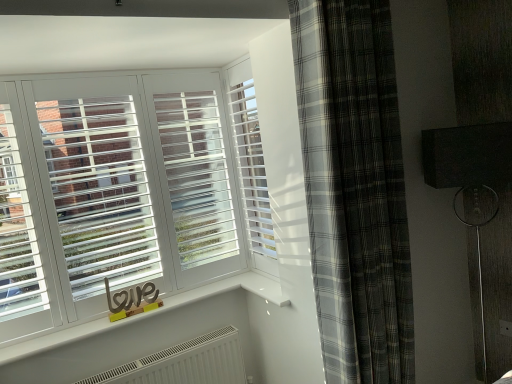
Question: Should I look upward or downward to see gray plaid curtain at right?

Choices:
 (A) up
 (B) down

Answer: (B)

Question: Should I look upward or downward to see white plastic blinds at center?

Choices:
 (A) up
 (B) down

Answer: (A)

Question: Are gray plaid curtain at right and white plastic blinds at center far apart?

Choices:
 (A) yes
 (B) no

Answer: (B)

Question: Is white plastic blinds at center inside gray plaid curtain at right?

Choices:
 (A) yes
 (B) no

Answer: (B)

Question: Considering the relative sizes of gray plaid curtain at right and white plastic blinds at center in the image provided, is gray plaid curtain at right taller than white plastic blinds at center?

Choices:
 (A) no
 (B) yes

Answer: (B)

Question: Can you confirm if gray plaid curtain at right is bigger than white plastic blinds at center?

Choices:
 (A) yes
 (B) no

Answer: (A)

Question: Considering the relative sizes of gray plaid curtain at right and white plastic blinds at center in the image provided, is gray plaid curtain at right shorter than white plastic blinds at center?

Choices:
 (A) yes
 (B) no

Answer: (B)

Question: Considering the relative sizes of gray plaid curtain at right and white plastic blinds at center in the image provided, is gray plaid curtain at right wider than white plastic blinds at center?

Choices:
 (A) no
 (B) yes

Answer: (B)

Question: Considering the relative sizes of white plastic blinds at center and gray plaid curtain at right in the image provided, is white plastic blinds at center wider than gray plaid curtain at right?

Choices:
 (A) no
 (B) yes

Answer: (A)

Question: Considering the relative sizes of white plastic blinds at center and gray plaid curtain at right in the image provided, is white plastic blinds at center taller than gray plaid curtain at right?

Choices:
 (A) yes
 (B) no

Answer: (B)

Question: Would you consider white plastic blinds at center to be distant from gray plaid curtain at right?

Choices:
 (A) yes
 (B) no

Answer: (B)

Question: Can we say white plastic blinds at center lies outside gray plaid curtain at right?

Choices:
 (A) no
 (B) yes

Answer: (B)

Question: Is white plastic blinds at center shorter than gray plaid curtain at right?

Choices:
 (A) no
 (B) yes

Answer: (B)

Question: From a real-world perspective, does white plastic blinds at center stand above gray plaid curtain at right?

Choices:
 (A) yes
 (B) no

Answer: (A)

Question: Considering the positions of white plastic blinds at center and gray plaid curtain at right in the image, is white plastic blinds at center taller or shorter than gray plaid curtain at right?

Choices:
 (A) short
 (B) tall

Answer: (A)